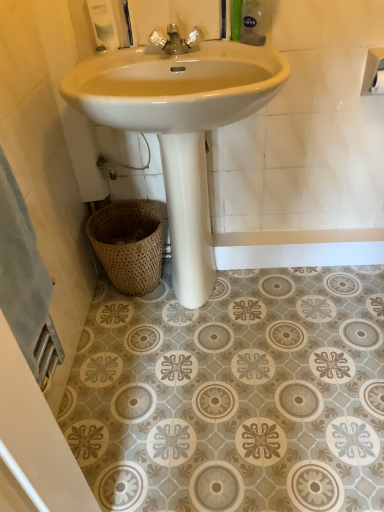
Identify the location of woven natural basket at lower left. (128, 245).

In order to face green plastic bottle at upper right, the first toiletry when ordered from right to left, should I rotate leftwards or rightwards?

Rotate right and turn 8.180 degrees.

The height and width of the screenshot is (512, 384). What do you see at coordinates (253, 23) in the screenshot?
I see `green plastic bottle at upper right, the second toiletry when ordered from left to right` at bounding box center [253, 23].

This screenshot has height=512, width=384. What do you see at coordinates (176, 40) in the screenshot? I see `chrome metallic faucet at center` at bounding box center [176, 40].

Locate an element on the screen. This screenshot has width=384, height=512. woven natural basket at lower left is located at coordinates (128, 245).

From the image's perspective, is chrome metallic faucet at center under white matte toilet paper at upper right, the 2th toilet paper viewed from the front?

No.

Are chrome metallic faucet at center and white matte toilet paper at upper right, which ranks as the first toilet paper in back-to-front order, making contact?

chrome metallic faucet at center is not next to white matte toilet paper at upper right, which ranks as the first toilet paper in back-to-front order, and they're not touching.

From a real-world perspective, between chrome metallic faucet at center and white matte toilet paper at upper right, which ranks as the first toilet paper in back-to-front order, who is vertically lower?

white matte toilet paper at upper right, which ranks as the first toilet paper in back-to-front order.

Looking at this image, considering their positions, is chrome metallic faucet at center located in front of or behind white matte toilet paper at upper right, which ranks as the first toilet paper in back-to-front order?

chrome metallic faucet at center is in front of white matte toilet paper at upper right, which ranks as the first toilet paper in back-to-front order.

Based on the photo, is white matte toilet paper at upper right, which ranks as the first toilet paper in back-to-front order, at the right side of white matte toilet paper at upper right, which ranks as the first toilet paper in front-to-back order?

Yes, white matte toilet paper at upper right, which ranks as the first toilet paper in back-to-front order, is to the right of white matte toilet paper at upper right, which ranks as the first toilet paper in front-to-back order.

Locate an element on the screen. toilet paper that appears above the white matte toilet paper at upper right, which ranks as the first toilet paper in back-to-front order (from the image's perspective) is located at coordinates (373, 72).

Is white matte toilet paper at upper right, the second toilet paper in the back-to-front sequence, located within white matte toilet paper at upper right, the 2th toilet paper viewed from the front?

No, white matte toilet paper at upper right, the 2th toilet paper viewed from the front, does not contain white matte toilet paper at upper right, the second toilet paper in the back-to-front sequence.

Consider the image. From a real-world perspective, is white matte toilet paper at upper right, the 2th toilet paper viewed from the front, positioned under white matte toilet paper at upper right, which ranks as the first toilet paper in front-to-back order, based on gravity?

Yes.

In the scene shown: Between woven natural basket at lower left and white matte toilet paper at upper right, which ranks as the first toilet paper in front-to-back order, which one has less height?

white matte toilet paper at upper right, which ranks as the first toilet paper in front-to-back order.

From the image's perspective, who appears lower, woven natural basket at lower left or white matte toilet paper at upper right, which ranks as the first toilet paper in front-to-back order?

woven natural basket at lower left.

Which object is wider, woven natural basket at lower left or white matte toilet paper at upper right, which ranks as the first toilet paper in front-to-back order?

woven natural basket at lower left.

Choose the correct answer: Is woven natural basket at lower left inside white matte toilet paper at upper right, which ranks as the first toilet paper in front-to-back order, or outside it?

woven natural basket at lower left is not enclosed by white matte toilet paper at upper right, which ranks as the first toilet paper in front-to-back order.

Considering the relative sizes of white matte toilet paper at upper right, which ranks as the first toilet paper in back-to-front order, and white glossy soap dispenser at upper left, which is the first toiletry from left to right, in the image provided, is white matte toilet paper at upper right, which ranks as the first toilet paper in back-to-front order, bigger than white glossy soap dispenser at upper left, which is the first toiletry from left to right,?

Indeed, white matte toilet paper at upper right, which ranks as the first toilet paper in back-to-front order, has a larger size compared to white glossy soap dispenser at upper left, which is the first toiletry from left to right.

Is white matte toilet paper at upper right, the 2th toilet paper viewed from the front, located outside white glossy soap dispenser at upper left, which is the first toiletry from left to right?

white matte toilet paper at upper right, the 2th toilet paper viewed from the front, lies outside white glossy soap dispenser at upper left, which is the first toiletry from left to right,'s area.

Is white matte toilet paper at upper right, the 2th toilet paper viewed from the front, turned away from white glossy soap dispenser at upper left, the second toiletry viewed from the right?

white matte toilet paper at upper right, the 2th toilet paper viewed from the front, does not have its back to white glossy soap dispenser at upper left, the second toiletry viewed from the right.

Is the depth of white matte toilet paper at upper right, which ranks as the first toilet paper in back-to-front order, less than that of white glossy soap dispenser at upper left, the second toiletry viewed from the right?

No, white matte toilet paper at upper right, which ranks as the first toilet paper in back-to-front order, is further to the viewer.

Is green plastic bottle at upper right, the second toiletry when ordered from left to right, to the right of chrome metallic faucet at center from the viewer's perspective?

Indeed, green plastic bottle at upper right, the second toiletry when ordered from left to right, is positioned on the right side of chrome metallic faucet at center.

Is point (252, 36) closer or farther from the camera than point (192, 42)?

Point (252, 36) appears to be farther away from the viewer than point (192, 42).

In the scene shown: Is green plastic bottle at upper right, the second toiletry when ordered from left to right, far away from chrome metallic faucet at center?

They are positioned close to each other.

From the picture: From a real-world perspective, is green plastic bottle at upper right, the second toiletry when ordered from left to right, over chrome metallic faucet at center?

Yes, from a real-world perspective, green plastic bottle at upper right, the second toiletry when ordered from left to right, is over chrome metallic faucet at center

Considering the relative positions of chrome metallic faucet at center and woven natural basket at lower left in the image provided, is chrome metallic faucet at center to the left of woven natural basket at lower left from the viewer's perspective?

No, chrome metallic faucet at center is not to the left of woven natural basket at lower left.

Considering the sizes of objects chrome metallic faucet at center and woven natural basket at lower left in the image provided, who is smaller, chrome metallic faucet at center or woven natural basket at lower left?

Smaller between the two is chrome metallic faucet at center.

Can you confirm if chrome metallic faucet at center is wider than woven natural basket at lower left?

In fact, chrome metallic faucet at center might be narrower than woven natural basket at lower left.

In terms of size, does woven natural basket at lower left appear bigger or smaller than chrome metallic faucet at center?

Clearly, woven natural basket at lower left is larger in size than chrome metallic faucet at center.

Can we say woven natural basket at lower left lies outside chrome metallic faucet at center?

woven natural basket at lower left lies outside chrome metallic faucet at center's area.

Is woven natural basket at lower left at the right side of chrome metallic faucet at center?

Incorrect, woven natural basket at lower left is not on the right side of chrome metallic faucet at center.

Who is shorter, woven natural basket at lower left or chrome metallic faucet at center?

chrome metallic faucet at center is shorter.

The width and height of the screenshot is (384, 512). I want to click on tap in front of the white matte toilet paper at upper right, the 2th toilet paper viewed from the front, so click(176, 40).

At what (x,y) coordinates should I click in order to perform the action: click on toilet paper above the white matte toilet paper at upper right, which ranks as the first toilet paper in back-to-front order (from a real-world perspective). Please return your answer as a coordinate pair (x, y). The image size is (384, 512). Looking at the image, I should click on point(373,72).

From the image, which object appears to be nearer to green plastic bottle at upper right, the second toiletry when ordered from left to right, chrome metallic faucet at center or white matte toilet paper at upper right, the 2th toilet paper viewed from the front?

The object closer to green plastic bottle at upper right, the second toiletry when ordered from left to right, is chrome metallic faucet at center.

Estimate the real-world distances between objects in this image. Which object is closer to chrome metallic faucet at center, white glossy soap dispenser at upper left, which is the first toiletry from left to right, or green plastic bottle at upper right, the first toiletry when ordered from right to left?

The object closer to chrome metallic faucet at center is white glossy soap dispenser at upper left, which is the first toiletry from left to right.

From the image, which object appears to be nearer to white glossy sink at center, white glossy soap dispenser at upper left, the second toiletry viewed from the right, or chrome metallic faucet at center?

chrome metallic faucet at center.

Based on their spatial positions, is white matte toilet paper at upper right, the 2th toilet paper viewed from the front, or white matte toilet paper at upper right, which ranks as the first toilet paper in front-to-back order, further from white glossy sink at center?

white matte toilet paper at upper right, the 2th toilet paper viewed from the front, lies further to white glossy sink at center than the other object.

When comparing their distances from white glossy soap dispenser at upper left, the second toiletry viewed from the right, does chrome metallic faucet at center or green plastic bottle at upper right, the first toiletry when ordered from right to left, seem closer?

Based on the image, chrome metallic faucet at center appears to be nearer to white glossy soap dispenser at upper left, the second toiletry viewed from the right.

Estimate the real-world distances between objects in this image. Which object is closer to white matte toilet paper at upper right, which ranks as the first toilet paper in back-to-front order, white glossy soap dispenser at upper left, which is the first toiletry from left to right, or white glossy sink at center?

Based on the image, white glossy sink at center appears to be nearer to white matte toilet paper at upper right, which ranks as the first toilet paper in back-to-front order.

When comparing their distances from chrome metallic faucet at center, does white glossy sink at center or green plastic bottle at upper right, the second toiletry when ordered from left to right, seem closer?

Among the two, green plastic bottle at upper right, the second toiletry when ordered from left to right, is located nearer to chrome metallic faucet at center.

From the image, which object appears to be farther from green plastic bottle at upper right, the first toiletry when ordered from right to left, white glossy sink at center or white matte toilet paper at upper right, which ranks as the first toilet paper in front-to-back order?

The object further to green plastic bottle at upper right, the first toiletry when ordered from right to left, is white glossy sink at center.

You are a GUI agent. You are given a task and a screenshot of the screen. Output one action in this format:
    pyautogui.click(x=<x>, y=<y>)
    Task: Click on the sink situated between chrome metallic faucet at center and white matte toilet paper at upper right, the second toilet paper in the back-to-front sequence, from left to right
    Image resolution: width=384 pixels, height=512 pixels.
    Given the screenshot: What is the action you would take?
    pyautogui.click(x=179, y=127)

You are a GUI agent. You are given a task and a screenshot of the screen. Output one action in this format:
    pyautogui.click(x=<x>, y=<y>)
    Task: Click on the sink that lies between chrome metallic faucet at center and woven natural basket at lower left from top to bottom
    
    Given the screenshot: What is the action you would take?
    pyautogui.click(x=179, y=127)

Locate an element on the screen. This screenshot has width=384, height=512. toiletry between white glossy soap dispenser at upper left, the second toiletry viewed from the right, and white glossy sink at center from top to bottom is located at coordinates (253, 23).

Identify the location of basket located between white glossy soap dispenser at upper left, the second toiletry viewed from the right, and white matte toilet paper at upper right, which ranks as the first toilet paper in front-to-back order, in the left-right direction. (x=128, y=245).